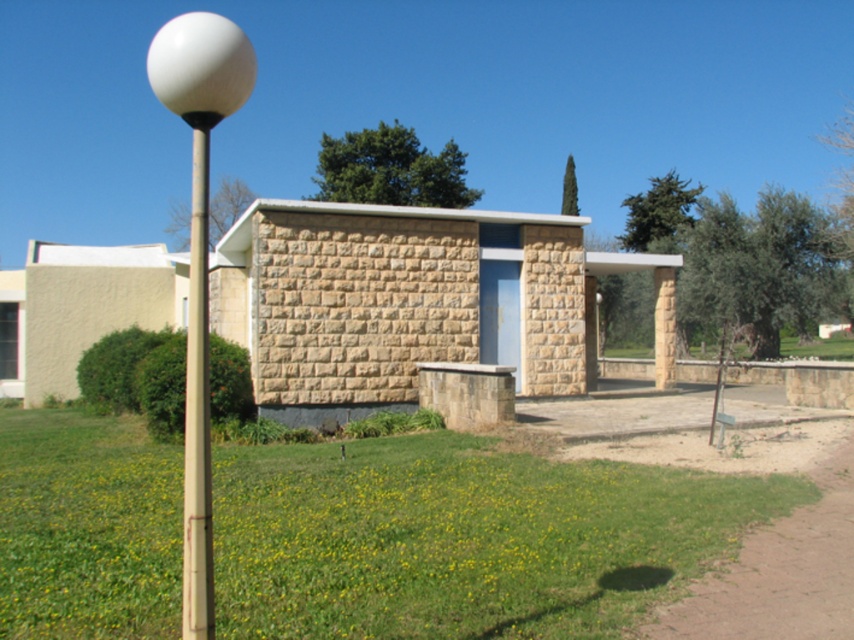
Looking at this image, who is taller, white glossy ball at left or metallic pole at left?

white glossy ball at left

You are a GUI agent. You are given a task and a screenshot of the screen. Output one action in this format:
    pyautogui.click(x=<x>, y=<y>)
    Task: Click on the white glossy ball at left
    Image resolution: width=854 pixels, height=640 pixels.
    Given the screenshot: What is the action you would take?
    pyautogui.click(x=199, y=259)

Is point (205, 364) farther from camera compared to point (200, 369)?

Yes, it is.

Find the location of a particular element. Image resolution: width=854 pixels, height=640 pixels. white glossy ball at left is located at coordinates (199, 259).

Measure the distance from brown stone shelter at center to white glossy ball at left.

brown stone shelter at center is 9.84 meters away from white glossy ball at left.

Does brown stone shelter at center have a smaller size compared to white glossy ball at left?

Indeed, brown stone shelter at center has a smaller size compared to white glossy ball at left.

Describe the element at coordinates (412, 301) in the screenshot. The image size is (854, 640). I see `brown stone shelter at center` at that location.

Locate an element on the screen. This screenshot has height=640, width=854. brown stone shelter at center is located at coordinates (412, 301).

Which is below, green grass at lower center or metallic pole at left?

green grass at lower center is below.

Can you confirm if green grass at lower center is shorter than metallic pole at left?

Yes.

In order to click on green grass at lower center in this screenshot , I will do `click(461, 538)`.

This screenshot has height=640, width=854. Identify the location of green grass at lower center. (461, 538).